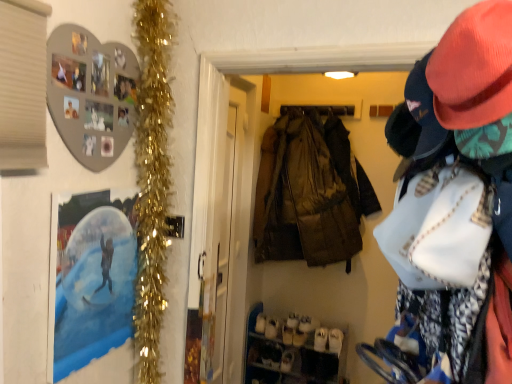
Question: Considering the positions of gold tinsel garland at left and camouflage fabric jacket at center in the image, is gold tinsel garland at left taller or shorter than camouflage fabric jacket at center?

Choices:
 (A) tall
 (B) short

Answer: (A)

Question: From the image's perspective, relative to camouflage fabric jacket at center, is gold tinsel garland at left above or below?

Choices:
 (A) above
 (B) below

Answer: (B)

Question: Which of these objects is positioned farthest from the metallic silver photo frame at left?

Choices:
 (A) matte pink hat at upper right
 (B) transparent plastic screen door at center
 (C) white suede shoe at lower center, marked as the 1th shoe in a left-to-right arrangement
 (D) white matte shoe rack at lower center
 (E) camouflage fabric jacket at center

Answer: (C)

Question: Considering the real-world distances, which object is closest to the transparent plastic screen door at center?

Choices:
 (A) white matte shoe rack at lower center
 (B) camouflage fabric jacket at center
 (C) white suede shoe at lower center, which is the second shoe from left to right
 (D) matte pink hat at upper right
 (E) metallic silver photo frame at left

Answer: (B)